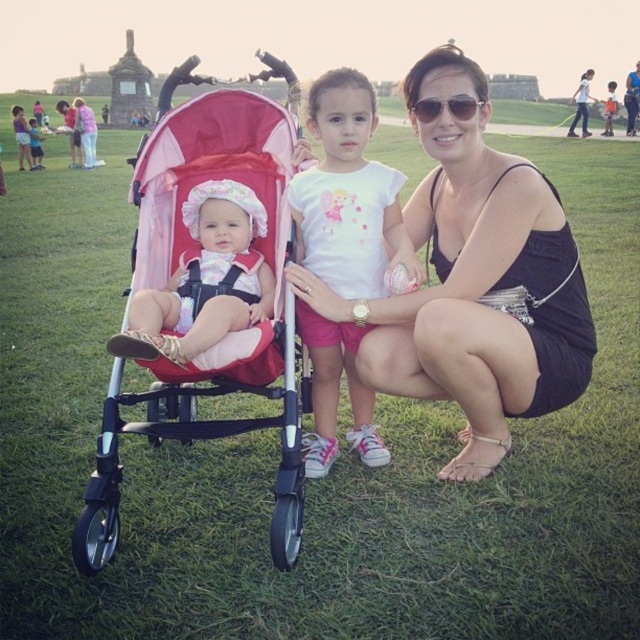
Question: Among these objects, which one is farthest from the camera?

Choices:
 (A) white cotton shirt at center
 (B) matte pink stroller at left
 (C) black satin dress at center
 (D) sunglasses at center

Answer: (D)

Question: Is black satin dress at center positioned in front of white cotton shirt at center?

Choices:
 (A) yes
 (B) no

Answer: (A)

Question: Does white cotton shirt at center have a smaller size compared to sunglasses at center?

Choices:
 (A) no
 (B) yes

Answer: (A)

Question: Which point is closer to the camera taking this photo?

Choices:
 (A) (419, 120)
 (B) (368, 390)

Answer: (B)

Question: Is the position of black satin dress at center more distant than that of pink fabric stroller at left?

Choices:
 (A) no
 (B) yes

Answer: (B)

Question: Estimate the real-world distances between objects in this image. Which object is closer to the sunglasses at center?

Choices:
 (A) pink fabric stroller at left
 (B) matte pink stroller at left
 (C) black satin dress at center

Answer: (C)